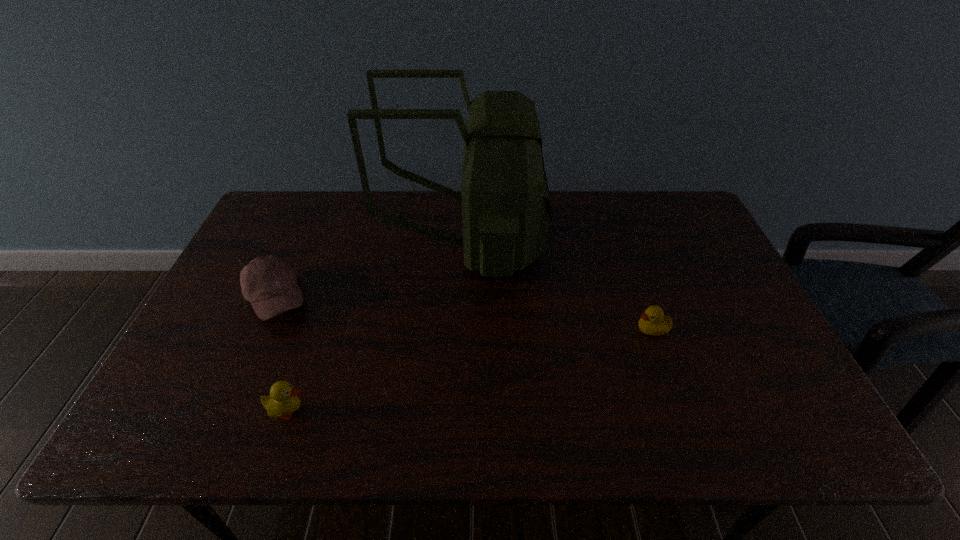
At what (x,y) coordinates should I click in order to perform the action: click on vacant space situated 0.350m on the face of the rightmost object. Please return your answer as a coordinate pair (x, y). Looking at the image, I should click on (500, 329).

Locate an element on the screen. This screenshot has width=960, height=540. vacant space located 0.120m on the face of the rightmost object is located at coordinates (588, 329).

The width and height of the screenshot is (960, 540). Identify the location of free location located 0.350m on the face of the rightmost object. (500, 329).

Identify the location of object at the far edge. This screenshot has height=540, width=960. (506, 210).

Where is `object situated at the near edge`? The height and width of the screenshot is (540, 960). object situated at the near edge is located at coordinates (283, 400).

Image resolution: width=960 pixels, height=540 pixels. I want to click on object located at the left edge, so click(x=269, y=283).

In the image, there is a desktop. Identify the location of vacant region at the far edge. (381, 198).

In the image, there is a desktop. Identify the location of vacant space at the left edge. The width and height of the screenshot is (960, 540). click(249, 251).

What are the coordinates of `vacant space at the right edge of the desktop` in the screenshot? It's located at (725, 306).

Where is `free space at the far left corner of the desktop`? This screenshot has width=960, height=540. free space at the far left corner of the desktop is located at coordinates (301, 206).